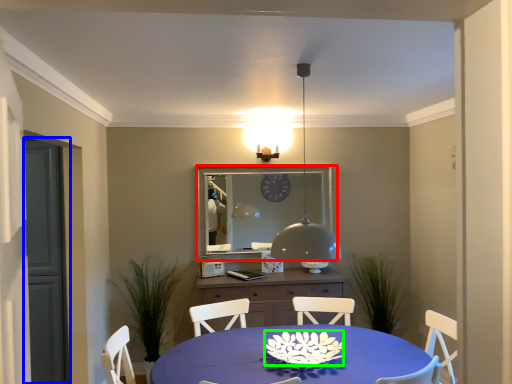
Question: Based on their relative distances, which object is nearer to mirror (highlighted by a red box)? Choose from glass door (highlighted by a blue box) and flower (highlighted by a green box).

Choices:
 (A) glass door
 (B) flower

Answer: (A)